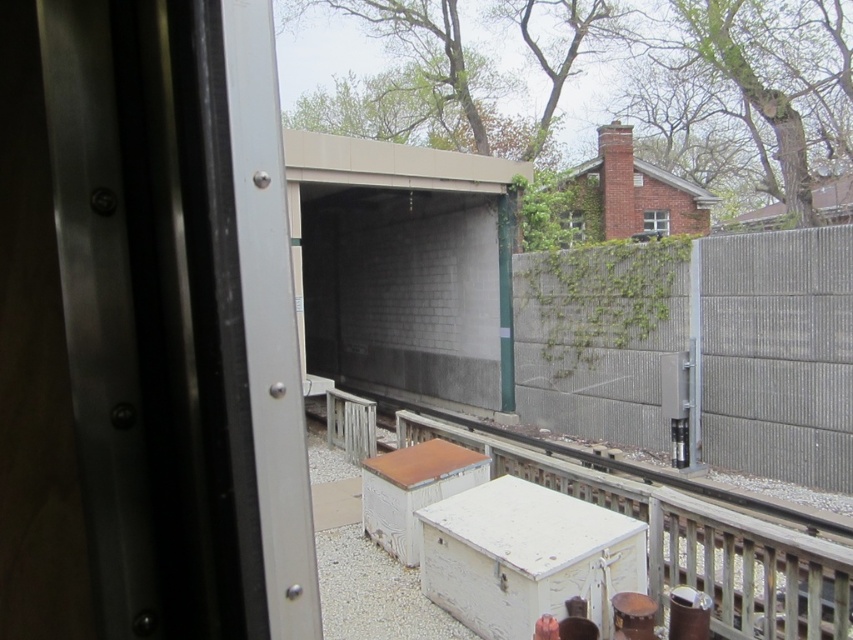
You are a passenger sitting near the window in the train. You notice the gray concrete fence at right and the clear glass window at upper right. Which object appears taller from your viewpoint?

The gray concrete fence at right is taller than the clear glass window at upper right, so the gray concrete fence at right appears taller from your viewpoint.

You are a passenger sitting in the train and looking out the window. You notice the gray concrete fence at right and the matte glass screen door at center. Which object is closer to you, the passenger?

The gray concrete fence at right is closer to you because it is in front of the matte glass screen door at center.

You are a passenger on the train and notice two objects outside the window. You see the white painted wood at center and the matte brick window at upper center. Which object appears taller from your viewpoint?

The matte brick window at upper center appears taller than the white painted wood at center because the white painted wood at center has a lesser height compared to matte brick window at upper center.